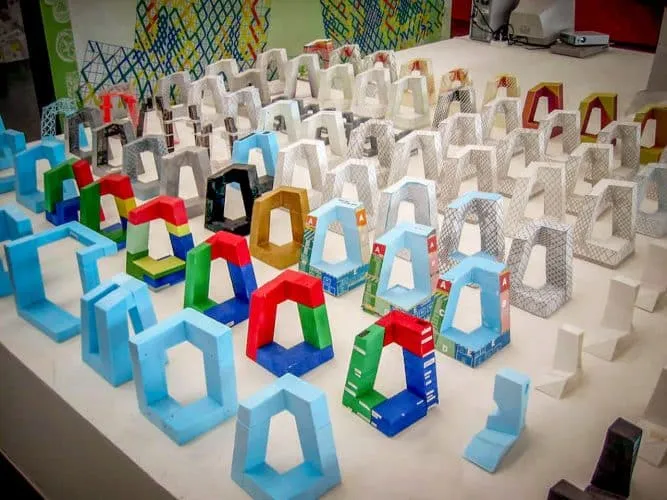
The image size is (667, 500). I want to click on computer monitor, so click(x=557, y=16).